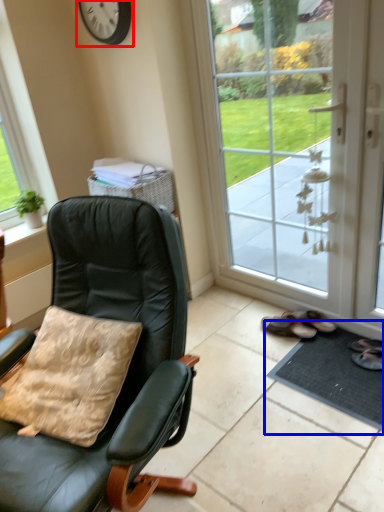
Question: Which object appears closest to the camera in this image, clock (highlighted by a red box) or doormat (highlighted by a blue box)?

Choices:
 (A) clock
 (B) doormat

Answer: (B)